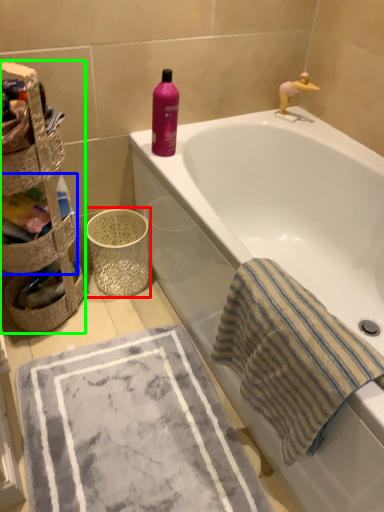
Question: Estimate the real-world distances between objects in this image. Which object is closer to basket container (highlighted by a red box), basket (highlighted by a blue box) or basket (highlighted by a green box)?

Choices:
 (A) basket
 (B) basket

Answer: (B)